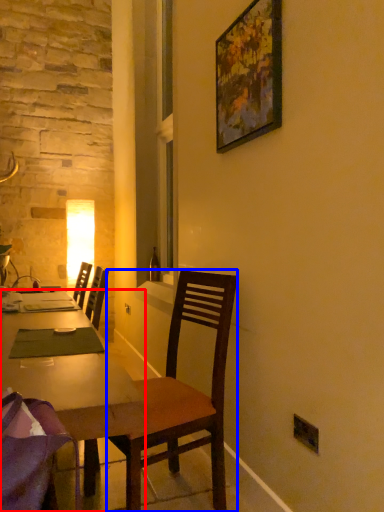
Question: Among these objects, which one is farthest to the camera, desk (highlighted by a red box) or chair (highlighted by a blue box)?

Choices:
 (A) desk
 (B) chair

Answer: (B)